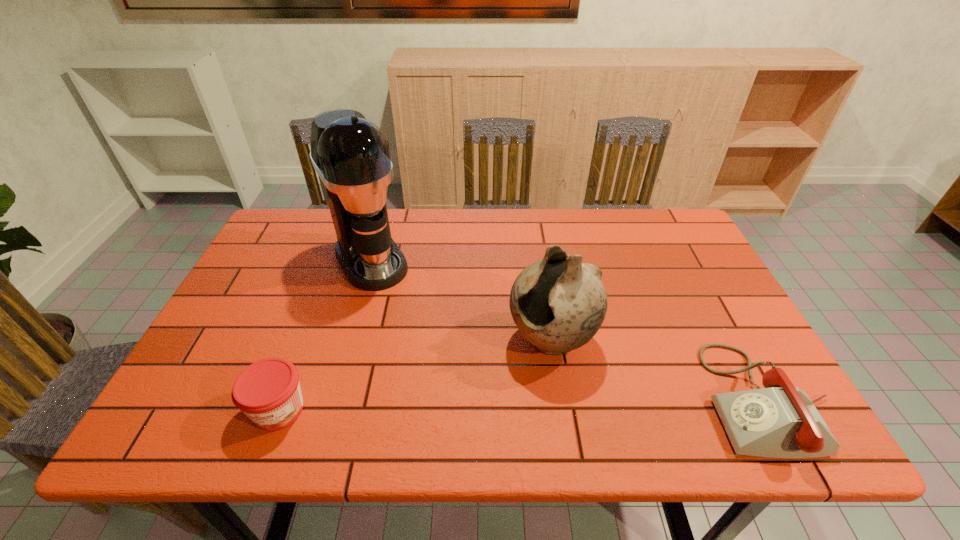
Find the location of a particular element. The image size is (960, 540). blank region between the jam and the coffee maker is located at coordinates (325, 335).

At what (x,y) coordinates should I click in order to perform the action: click on the third closest object to the second object from right to left. Please return your answer as a coordinate pair (x, y). The image size is (960, 540). Looking at the image, I should click on (268, 391).

At what (x,y) coordinates should I click in order to perform the action: click on object that is the third closest one to the pottery. Please return your answer as a coordinate pair (x, y). Looking at the image, I should click on (268, 391).

Find the location of a particular element. free location that satisfies the following two spatial constraints: 1. on the front side of the telephone; 2. on the dial of the tallest object is located at coordinates (331, 400).

Find the location of `vacant area in the image that satisfies the following two spatial constraints: 1. on the front side of the tallest object; 2. on the right side of the second tallest object`. vacant area in the image that satisfies the following two spatial constraints: 1. on the front side of the tallest object; 2. on the right side of the second tallest object is located at coordinates (348, 340).